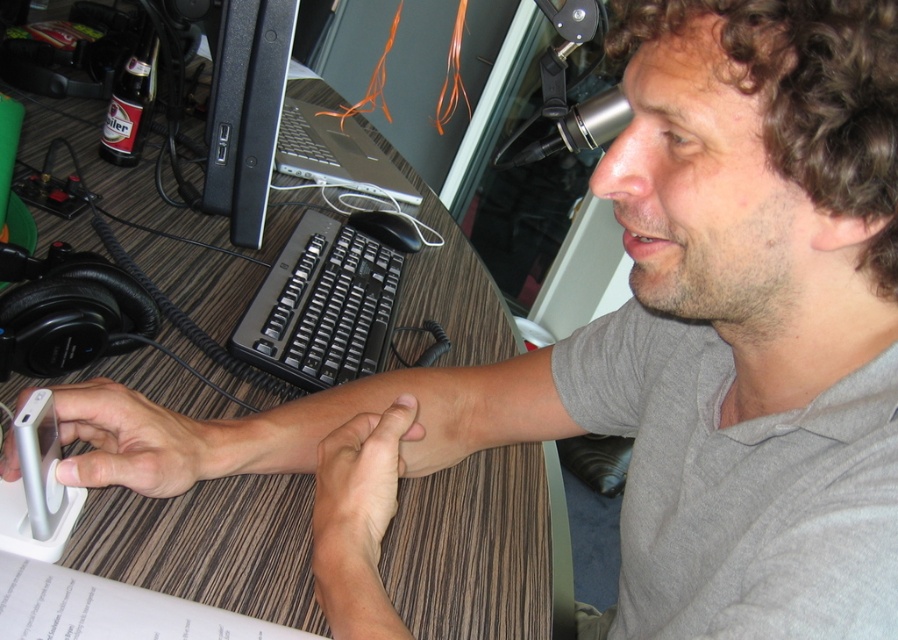
Question: Is black plastic keyboard at center wider than black plastic mouse at center?

Choices:
 (A) yes
 (B) no

Answer: (A)

Question: Where is black plastic keyboard at center located in relation to black plastic computer monitor at upper left in the image?

Choices:
 (A) right
 (B) left

Answer: (A)

Question: Observing the image, what is the correct spatial positioning of wooden at center in reference to black plastic keyboard at center?

Choices:
 (A) below
 (B) above

Answer: (B)

Question: Which object appears farthest from the camera in this image?

Choices:
 (A) silver metallic phone at lower left
 (B) black plastic computer monitor at upper left
 (C) black plastic mouse at center

Answer: (C)

Question: Which point is closer to the camera?

Choices:
 (A) black plastic computer monitor at upper left
 (B) black plastic mouse at center

Answer: (A)

Question: Considering the real-world distances, which object is farthest from the black plastic computer monitor at upper left?

Choices:
 (A) silver metallic phone at lower left
 (B) black plastic mouse at center

Answer: (A)